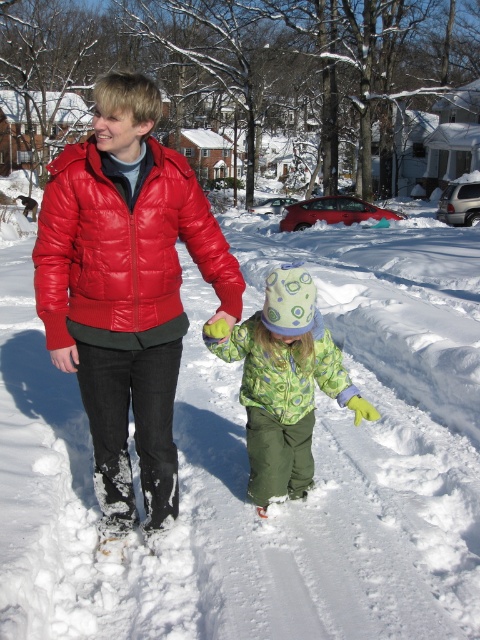
Question: Observing the image, what is the correct spatial positioning of shiny red jacket at center in reference to green fuzzy coat at center?

Choices:
 (A) above
 (B) below

Answer: (A)

Question: Considering the real-world distances, which object is closest to the shiny red puffer jacket at left?

Choices:
 (A) shiny red jacket at center
 (B) white fluffy snow at center
 (C) green fuzzy coat at center
 (D) green textured jacket at center

Answer: (A)

Question: Considering the real-world distances, which object is farthest from the green fuzzy coat at center?

Choices:
 (A) shiny red puffer jacket at left
 (B) green textured jacket at center
 (C) shiny red jacket at center

Answer: (A)

Question: Among these points, which one is nearest to the camera?

Choices:
 (A) (327, 365)
 (B) (131, 154)
 (C) (62, 492)

Answer: (B)

Question: Is green fuzzy coat at center to the right of green textured jacket at center from the viewer's perspective?

Choices:
 (A) no
 (B) yes

Answer: (B)

Question: Where is white fluffy snow at center located in relation to green fuzzy coat at center in the image?

Choices:
 (A) above
 (B) below

Answer: (A)